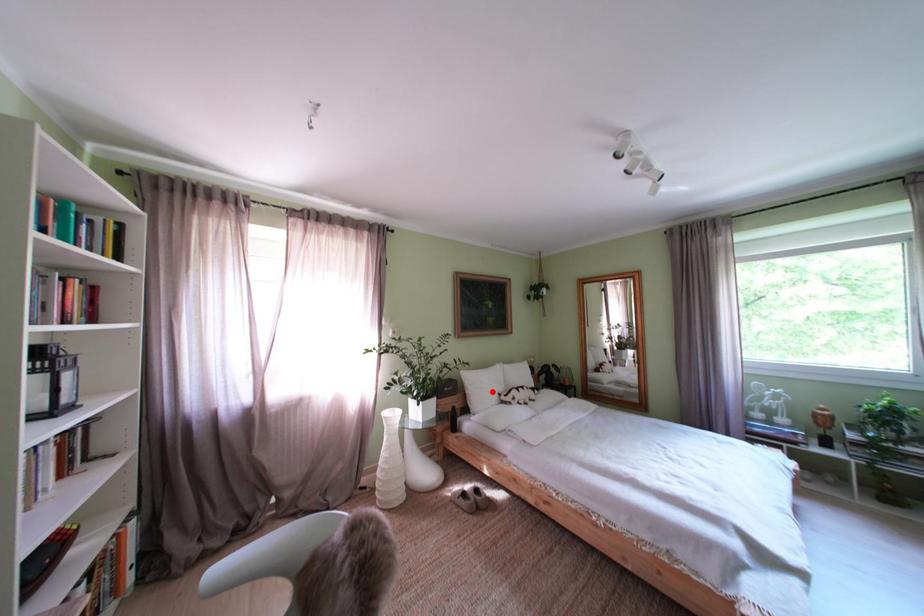
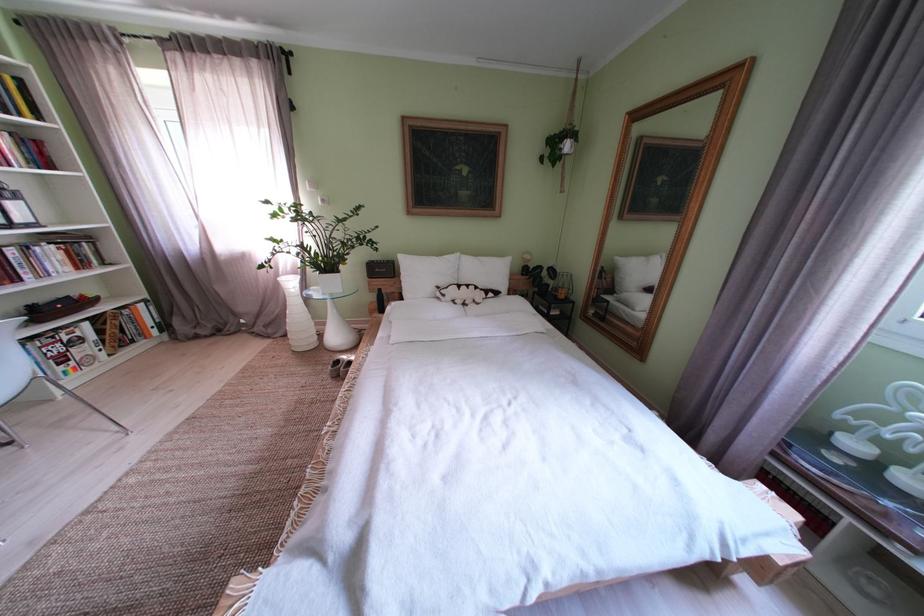
Question: I am providing you with two images of the same scene from different viewpoints. A red point is shown in image1. For the corresponding object point in image2, is it positioned nearer or farther from the camera?

Choices:
 (A) Nearer
 (B) Farther

Answer: (A)